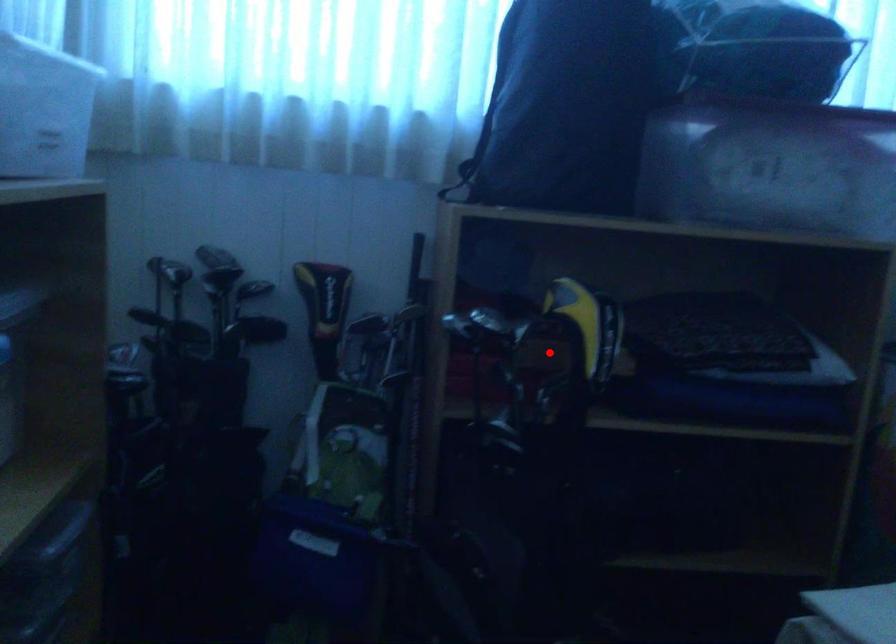
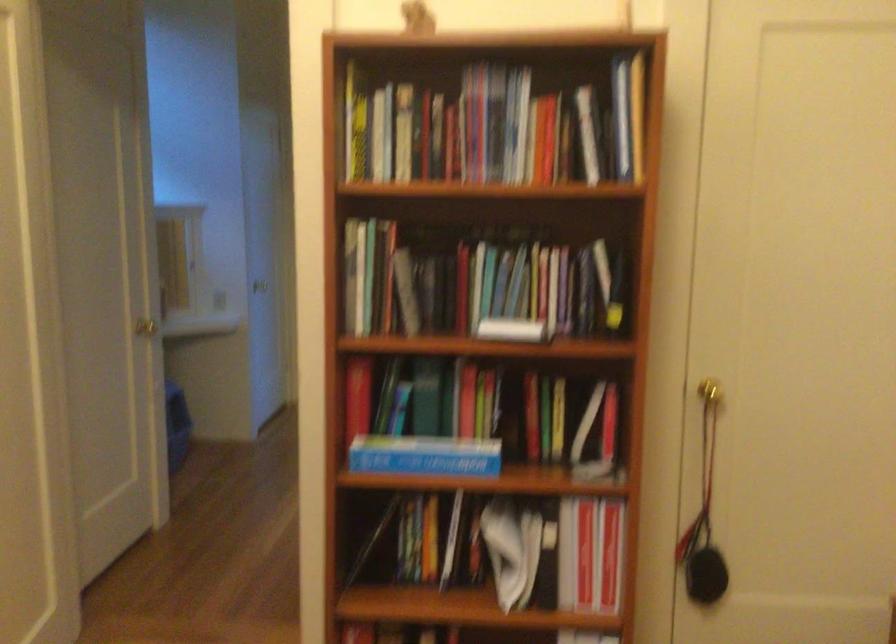
Question: I am providing you with two images of the same scene from different viewpoints. A red point is marked on the first image. Can you still see the location of the red point in image 2?

Choices:
 (A) Yes
 (B) No

Answer: (B)